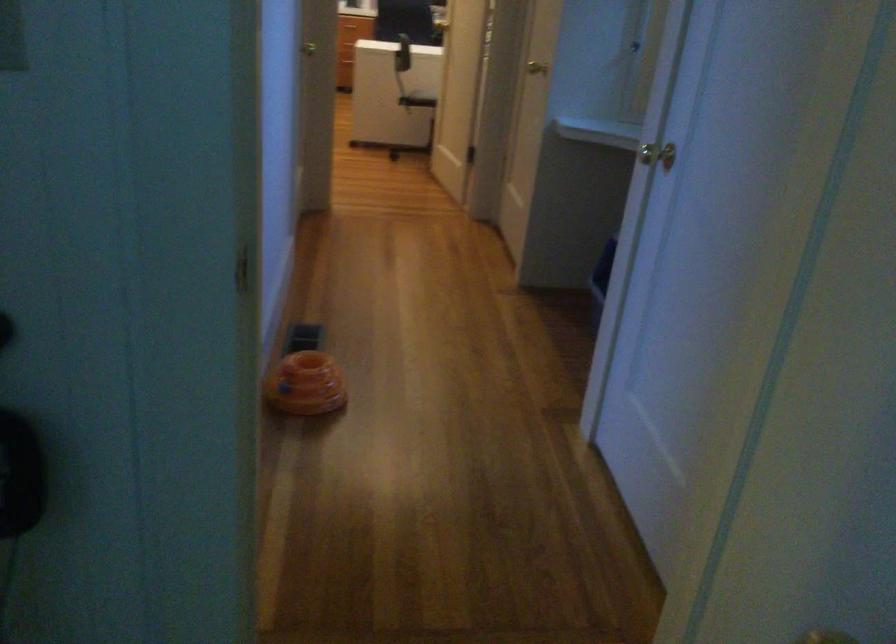
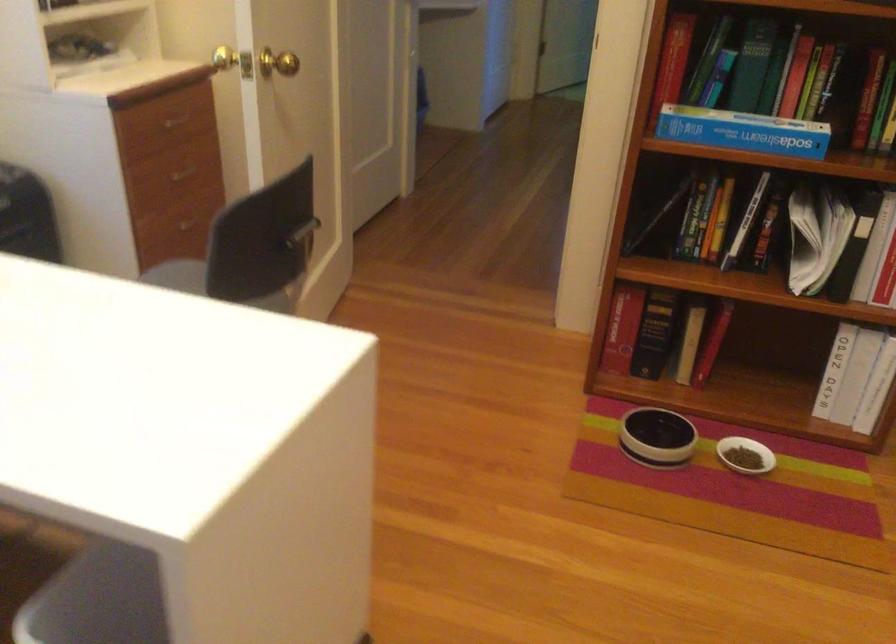
Find the pixel in the second image that matches the point at 467,129 in the first image.

(304, 232)